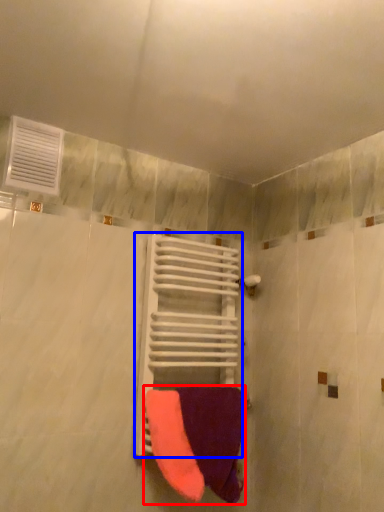
Question: Which point is closer to the camera, towel (highlighted by a red box) or balustrade (highlighted by a blue box)?

Choices:
 (A) towel
 (B) balustrade

Answer: (A)